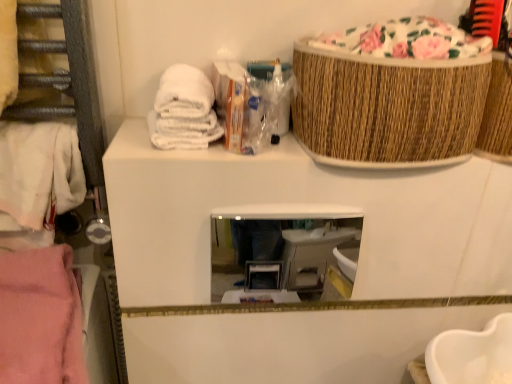
Question: Could you tell me if clear glass mirror at center is turned towards pink fabric at left, which is the 1th clothing in bottom-to-top order?

Choices:
 (A) yes
 (B) no

Answer: (B)

Question: From a real-world perspective, is clear glass mirror at center over pink fabric at left, the second clothing viewed from the top?

Choices:
 (A) no
 (B) yes

Answer: (B)

Question: Does clear glass mirror at center lie in front of pink fabric at left, the second clothing viewed from the top?

Choices:
 (A) yes
 (B) no

Answer: (B)

Question: Can you confirm if clear glass mirror at center is positioned to the left of pink fabric at left, which is the 1th clothing in bottom-to-top order?

Choices:
 (A) yes
 (B) no

Answer: (B)

Question: Considering the relative sizes of clear glass mirror at center and pink fabric at left, which is the 1th clothing in bottom-to-top order, in the image provided, is clear glass mirror at center shorter than pink fabric at left, which is the 1th clothing in bottom-to-top order,?

Choices:
 (A) no
 (B) yes

Answer: (A)

Question: From a real-world perspective, relative to woven brown basket at upper right, is pink fabric at left, the second clothing viewed from the top, vertically above or below?

Choices:
 (A) below
 (B) above

Answer: (A)

Question: Is pink fabric at left, which is the 1th clothing in bottom-to-top order, inside or outside of woven brown basket at upper right?

Choices:
 (A) inside
 (B) outside

Answer: (B)

Question: From the image's perspective, is pink fabric at left, the second clothing viewed from the top, located above or below woven brown basket at upper right?

Choices:
 (A) below
 (B) above

Answer: (A)

Question: Considering the positions of pink fabric at left, the second clothing viewed from the top, and woven brown basket at upper right in the image, is pink fabric at left, the second clothing viewed from the top, taller or shorter than woven brown basket at upper right?

Choices:
 (A) tall
 (B) short

Answer: (B)

Question: Looking at their shapes, would you say woven brown basket at upper right is wider or thinner than clear glass mirror at center?

Choices:
 (A) wide
 (B) thin

Answer: (A)

Question: From a real-world perspective, is woven brown basket at upper right above or below clear glass mirror at center?

Choices:
 (A) below
 (B) above

Answer: (B)

Question: In the image, is woven brown basket at upper right positioned in front of or behind clear glass mirror at center?

Choices:
 (A) front
 (B) behind

Answer: (A)

Question: Considering the positions of woven brown basket at upper right and clear glass mirror at center in the image, is woven brown basket at upper right taller or shorter than clear glass mirror at center?

Choices:
 (A) tall
 (B) short

Answer: (A)

Question: Is white cotton towel at left, the second clothing when ordered from bottom to top, wider or thinner than clear glass mirror at center?

Choices:
 (A) wide
 (B) thin

Answer: (A)

Question: From the image's perspective, is white cotton towel at left, the second clothing when ordered from bottom to top, positioned above or below clear glass mirror at center?

Choices:
 (A) above
 (B) below

Answer: (A)